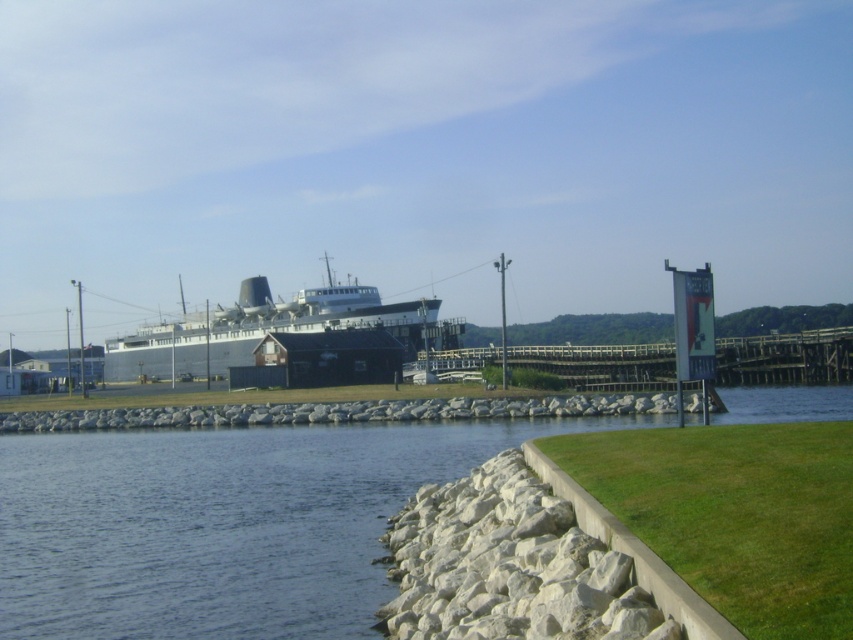
You are standing on the wooden planks at center and want to jump into the water. Based on the scene, which direction should you move to reach the clear water at lower left?

The clear water at lower left is smaller than the wooden planks at center, so you should move towards the lower left direction to reach the clear water at lower left.

Please provide the coordinates of the gray metallic ship at center in the image.

The gray metallic ship at center is located at coordinates point (270, 330).